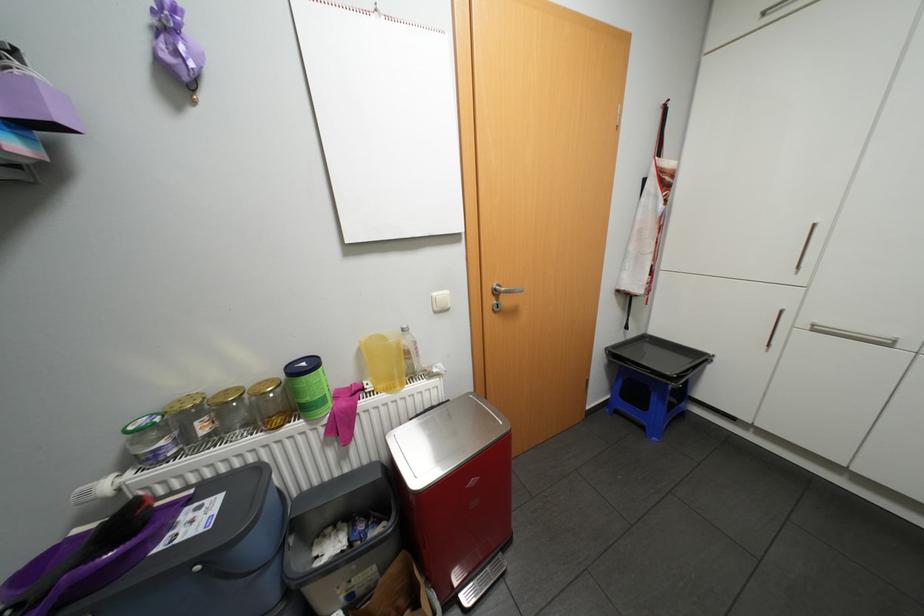
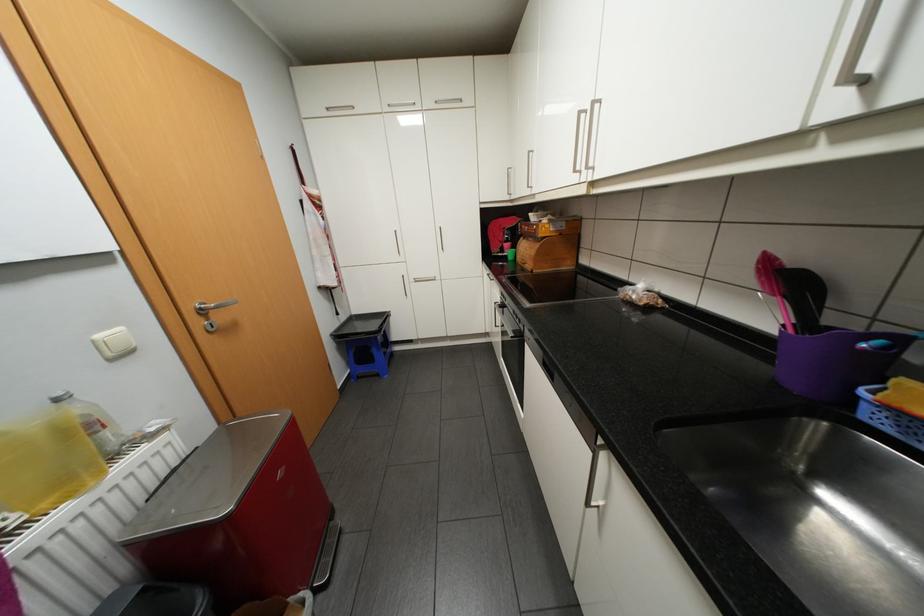
Where in the second image is the point corresponding to point (650, 427) from the first image?

(385, 374)